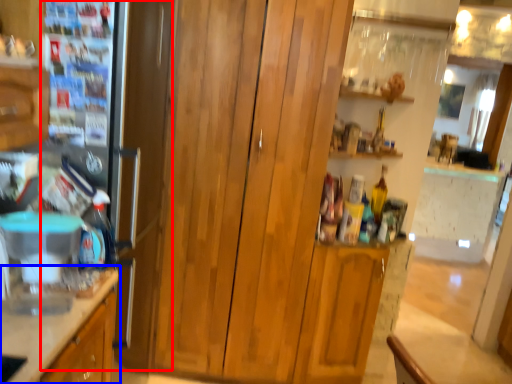
Question: Which object appears farthest to the camera in this image, fridge (highlighted by a red box) or cabinetry (highlighted by a blue box)?

Choices:
 (A) fridge
 (B) cabinetry

Answer: (A)